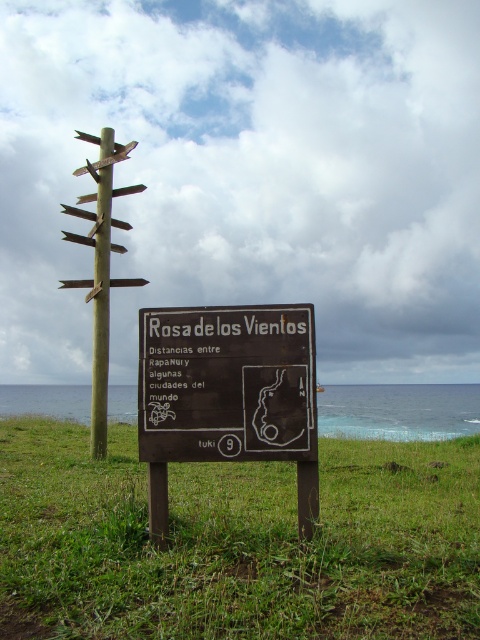
Question: Which object is closer to the camera taking this photo?

Choices:
 (A) wooden signpost at left
 (B) wooden signpost at center
 (C) brown wooden sign at center

Answer: (C)

Question: Based on their relative distances, which object is farther from the wooden signpost at center?

Choices:
 (A) green grass at center
 (B) brown wooden sign at center

Answer: (B)

Question: From the image, what is the correct spatial relationship of brown wooden sign at center in relation to wooden signpost at center?

Choices:
 (A) right
 (B) left

Answer: (A)

Question: Which object is farther from the camera taking this photo?

Choices:
 (A) brown wooden sign at center
 (B) green grass at center

Answer: (A)

Question: Is brown wooden sign at center further to camera compared to wooden signpost at center?

Choices:
 (A) yes
 (B) no

Answer: (B)

Question: Is the position of green grass at center more distant than that of wooden signpost at left?

Choices:
 (A) yes
 (B) no

Answer: (B)